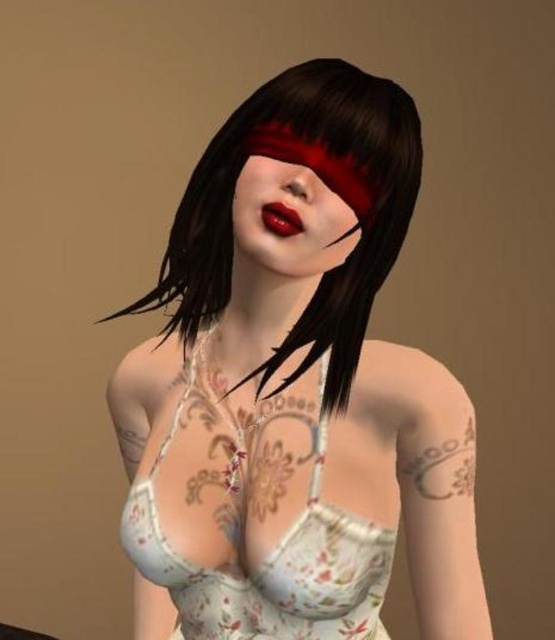
Question: Which point appears farthest from the camera in this image?

Choices:
 (A) (274, 211)
 (B) (396, 88)
 (C) (325, 417)

Answer: (B)

Question: Observing the image, what is the correct spatial positioning of matte white lingerie at center in reference to floral lace bikini top at center?

Choices:
 (A) right
 (B) left

Answer: (A)

Question: Is the position of matte white lingerie at center less distant than that of matte red lipstick at center?

Choices:
 (A) yes
 (B) no

Answer: (A)

Question: Which point is farther to the camera?

Choices:
 (A) floral lace bikini top at center
 (B) matte white lingerie at center
 (C) matte red lipstick at center

Answer: (A)

Question: Estimate the real-world distances between objects in this image. Which object is closer to the matte red lipstick at center?

Choices:
 (A) floral lace bikini top at center
 (B) matte white lingerie at center

Answer: (B)

Question: Observing the image, what is the correct spatial positioning of matte white lingerie at center in reference to matte red lipstick at center?

Choices:
 (A) right
 (B) left

Answer: (B)